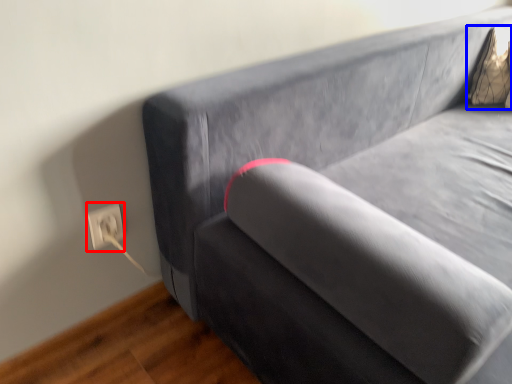
Question: Which object appears closest to the camera in this image, electric outlet (highlighted by a red box) or pillow (highlighted by a blue box)?

Choices:
 (A) electric outlet
 (B) pillow

Answer: (A)